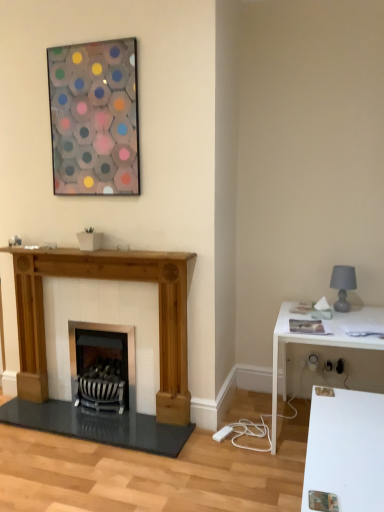
Question: Is point (94, 126) positioned closer to the camera than point (336, 306)?

Choices:
 (A) farther
 (B) closer

Answer: (B)

Question: In the image, is translucent glass hexagon at upper center positioned in front of or behind gray matte lampshade at right?

Choices:
 (A) front
 (B) behind

Answer: (A)

Question: Which object is the closest to the white glossy table at right?

Choices:
 (A) black striped wood burning stove at center
 (B) natural wood fireplace at left
 (C) translucent glass hexagon at upper center
 (D) gray matte lampshade at right

Answer: (D)

Question: Based on their relative distances, which object is farther from the translucent glass hexagon at upper center?

Choices:
 (A) natural wood fireplace at left
 (B) gray matte lampshade at right
 (C) black striped wood burning stove at center
 (D) white glossy table at right

Answer: (B)